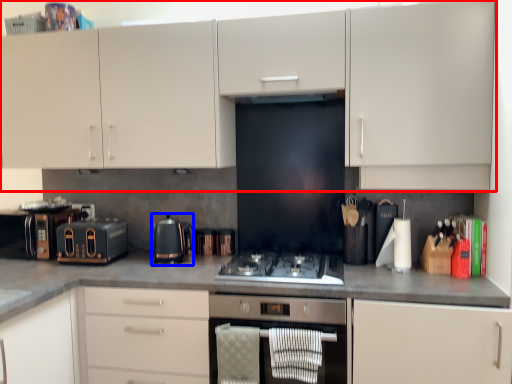
Question: Which object is further to the camera taking this photo, cabinetry (highlighted by a red box) or kitchen appliance (highlighted by a blue box)?

Choices:
 (A) cabinetry
 (B) kitchen appliance

Answer: (B)